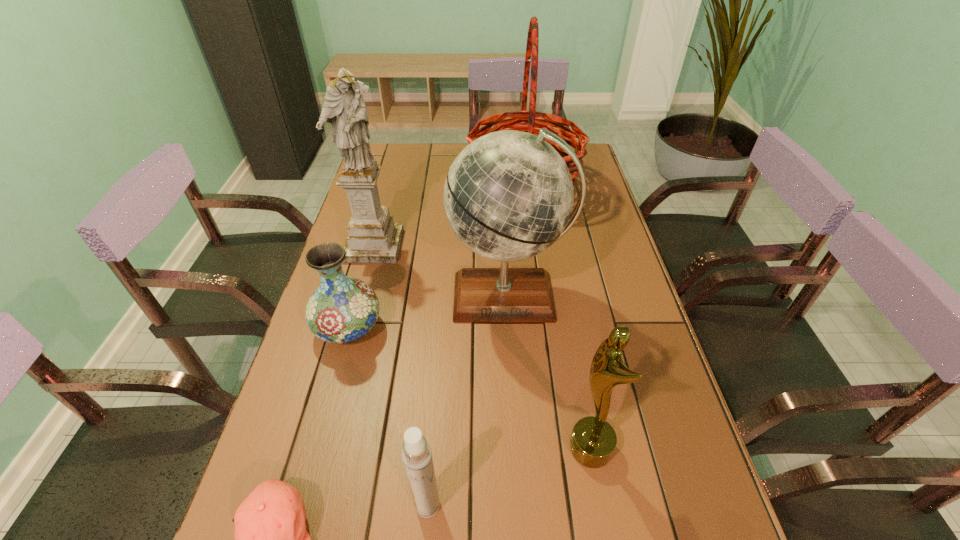
Find the location of a particular element. The width and height of the screenshot is (960, 540). basket is located at coordinates (533, 124).

I want to click on sculpture, so click(x=373, y=237).

Locate an element on the screen. globe is located at coordinates click(508, 196).

Find the location of `award`. award is located at coordinates (593, 440).

The width and height of the screenshot is (960, 540). Find the location of `the fourth shortest object`. the fourth shortest object is located at coordinates (593, 440).

This screenshot has height=540, width=960. I want to click on aerosol can, so click(x=417, y=457).

Locate an element on the screen. This screenshot has height=540, width=960. vase is located at coordinates [342, 309].

I want to click on vacant space located 0.350m on the handle side of the basket, so click(x=369, y=187).

Find the location of a particular element. Image resolution: width=960 pixels, height=540 pixels. vacant space situated 0.130m on the handle side of the basket is located at coordinates (430, 187).

Locate an element on the screen. free space located on the handle side of the basket is located at coordinates (394, 187).